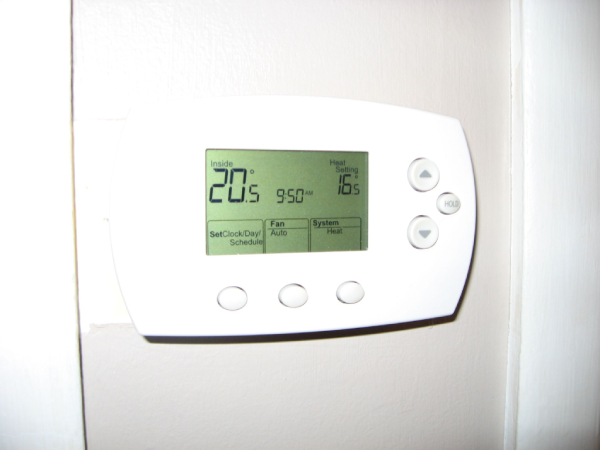
At what (x,y) coordinates should I click in order to perform the action: click on digital time display. Please return your answer as a coordinate pair (x, y). The width and height of the screenshot is (600, 450). Looking at the image, I should click on (282, 200), (286, 195), (290, 197), (300, 198).